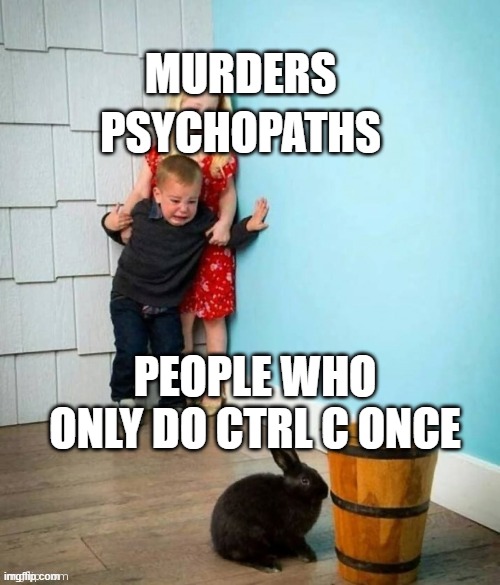
I want to click on old fashioned wood bucket, so click(386, 478).